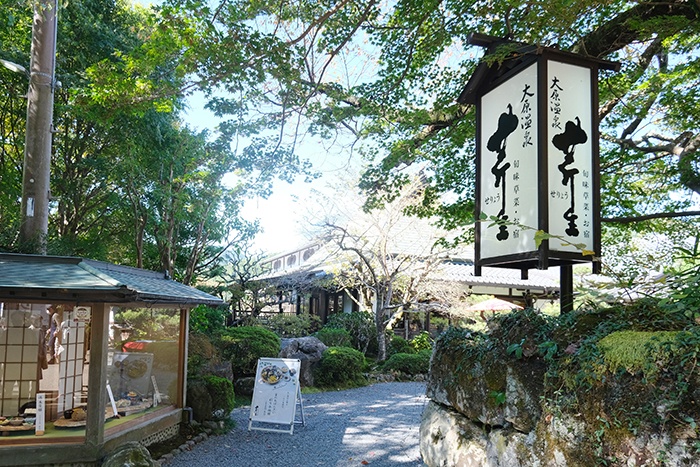
Locate an element on the screen. The height and width of the screenshot is (467, 700). food in display is located at coordinates (69, 418), (136, 403), (8, 416).